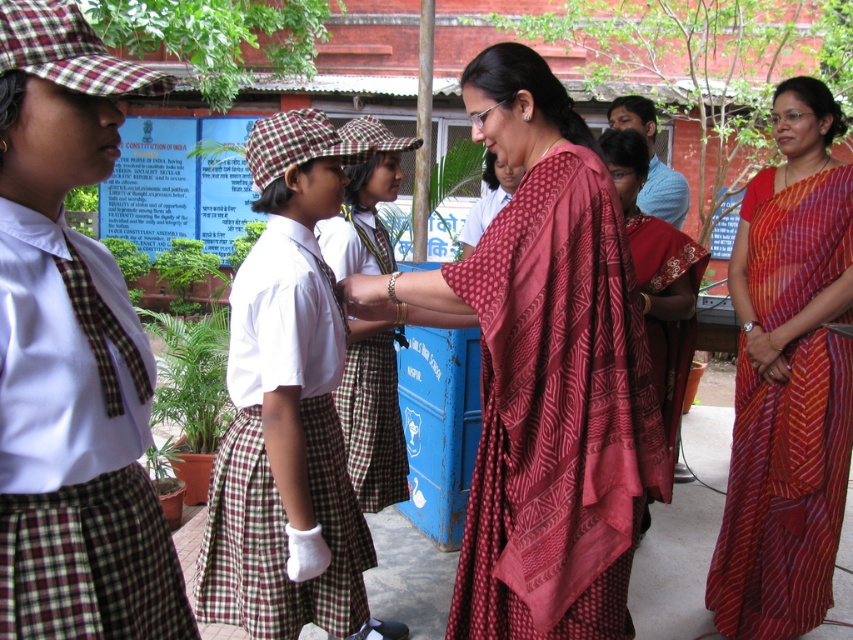
You are standing at the origin point in the image. Which of the two points, point 1 at coordinates point (28, 502) or point 2 at coordinates point (674, 435), is closer to you?

Point 1 at coordinates point (28, 502) is closer to you because it is in front of point 2 at coordinates point (674, 435).

You are standing in the school scene and want to move from the point at coordinates point [492,385] to the point at coordinates point [781,602]. Is the path between them clear?

Point [492,385] is in front of point [781,602], so the path between them is clear.